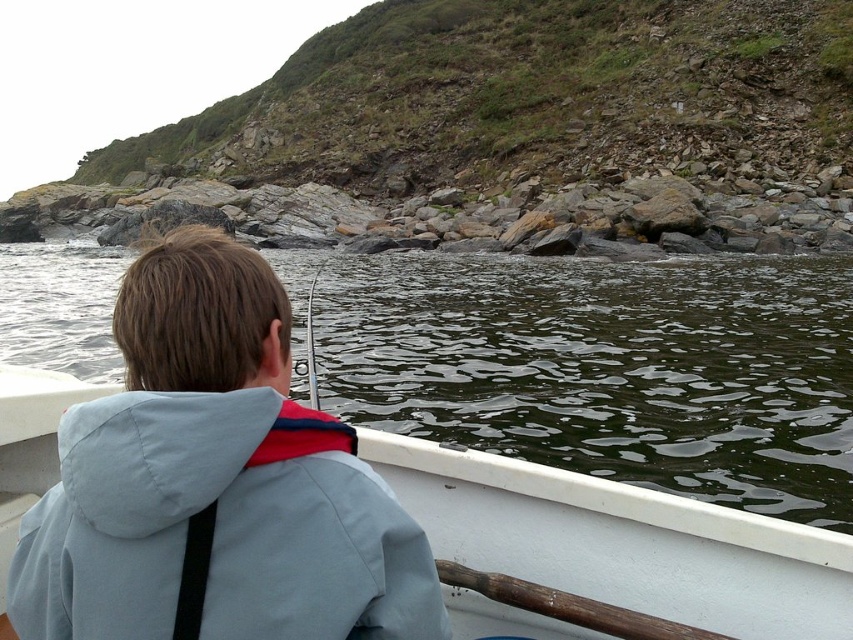
Question: Does rockymaterial/texture at upper center have a lesser width compared to greenish water at center?

Choices:
 (A) no
 (B) yes

Answer: (A)

Question: Among these points, which one is nearest to the camera?

Choices:
 (A) pyautogui.click(x=747, y=592)
 (B) pyautogui.click(x=430, y=339)
 (C) pyautogui.click(x=94, y=435)

Answer: (C)

Question: Is greenish water at center above light blue fabric jacket at upper left?

Choices:
 (A) no
 (B) yes

Answer: (B)

Question: Does rockymaterial/texture at upper center have a smaller size compared to greenish water at center?

Choices:
 (A) no
 (B) yes

Answer: (A)

Question: Which of the following is the farthest from the observer?

Choices:
 (A) click(x=395, y=512)
 (B) click(x=601, y=333)
 (C) click(x=390, y=104)

Answer: (C)

Question: Based on their relative distances, which object is farther from the rockymaterial/texture at upper center?

Choices:
 (A) light blue fabric jacket at upper left
 (B) greenish water at center

Answer: (A)